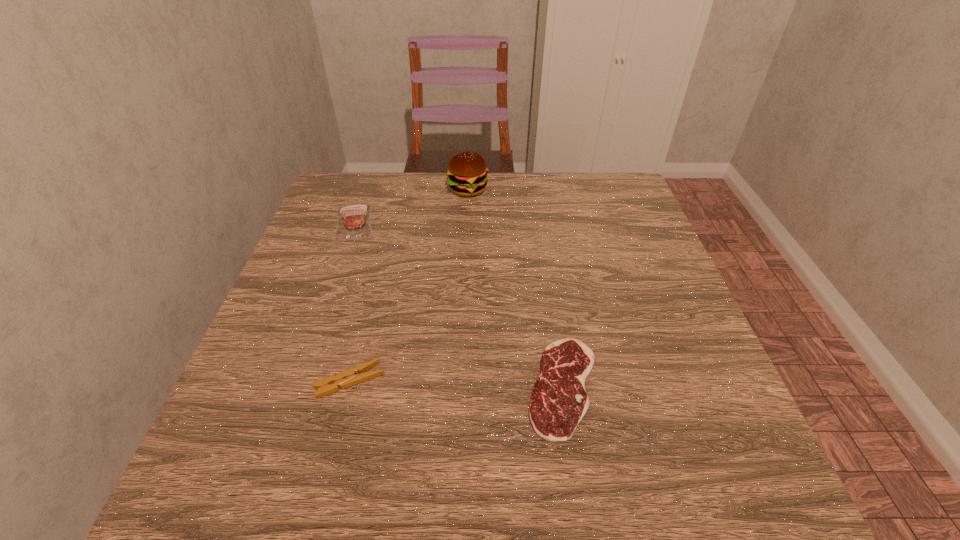
Where is `the farthest object`? The width and height of the screenshot is (960, 540). the farthest object is located at coordinates (467, 172).

Where is `hamburger`? hamburger is located at coordinates (467, 172).

What are the coordinates of `the taller steak` in the screenshot? It's located at (354, 221).

Where is `the farther steak`? The height and width of the screenshot is (540, 960). the farther steak is located at coordinates (354, 221).

Where is `clothespin`? Image resolution: width=960 pixels, height=540 pixels. clothespin is located at coordinates (357, 374).

Identify the location of the rightmost object. (559, 401).

You are a GUI agent. You are given a task and a screenshot of the screen. Output one action in this format:
    pyautogui.click(x=<x>, y=<y>)
    Task: Click on the nearer steak
    
    Given the screenshot: What is the action you would take?
    pyautogui.click(x=559, y=401)

The width and height of the screenshot is (960, 540). Identify the location of vacant space positioned 0.170m on the left of the tallest object. (386, 190).

Identify the location of vacant region located on the right of the taller steak. This screenshot has height=540, width=960. (472, 222).

What are the coordinates of `free spot located 0.090m on the back of the clothespin` in the screenshot? It's located at (364, 325).